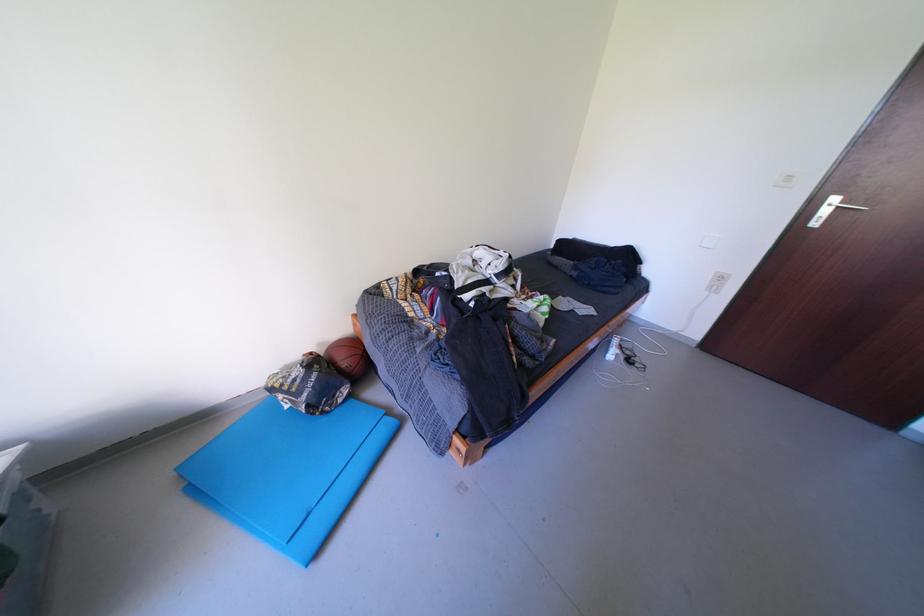
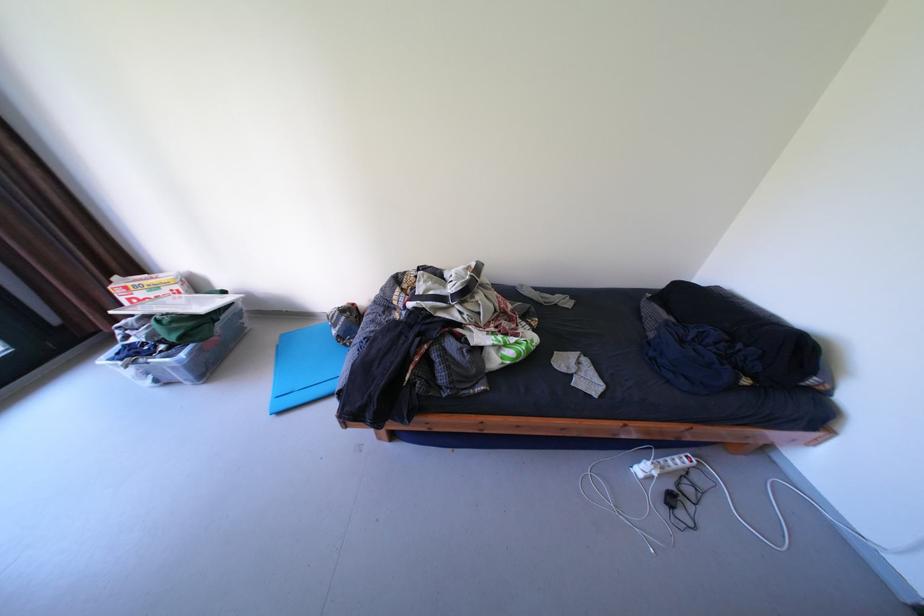
Locate, in the second image, the point that corresponds to (x=190, y=507) in the first image.

(283, 353)